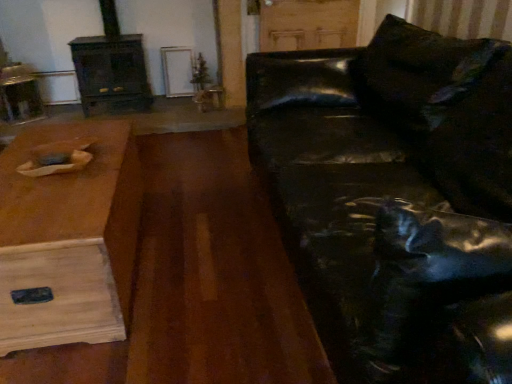
Question: Is dark wood fireplace at left touching shiny black leather couch at right?

Choices:
 (A) no
 (B) yes

Answer: (A)

Question: Is dark wood fireplace at left behind shiny black leather couch at right?

Choices:
 (A) yes
 (B) no

Answer: (A)

Question: Is dark wood fireplace at left far from shiny black leather couch at right?

Choices:
 (A) yes
 (B) no

Answer: (A)

Question: Does dark wood fireplace at left have a lesser width compared to shiny black leather couch at right?

Choices:
 (A) no
 (B) yes

Answer: (B)

Question: From the image's perspective, is dark wood fireplace at left beneath shiny black leather couch at right?

Choices:
 (A) no
 (B) yes

Answer: (A)

Question: Is point pyautogui.click(x=410, y=44) closer or farther from the camera than point pyautogui.click(x=110, y=69)?

Choices:
 (A) closer
 (B) farther

Answer: (A)

Question: Relative to dark wood fireplace at left, is shiny black leather couch at right in front or behind?

Choices:
 (A) front
 (B) behind

Answer: (A)

Question: Considering the positions of shiny black leather couch at right and dark wood fireplace at left in the image, is shiny black leather couch at right bigger or smaller than dark wood fireplace at left?

Choices:
 (A) small
 (B) big

Answer: (B)

Question: From a real-world perspective, is shiny black leather couch at right above or below dark wood fireplace at left?

Choices:
 (A) above
 (B) below

Answer: (B)

Question: Is wooden table at left in front of or behind shiny black leather couch at right in the image?

Choices:
 (A) front
 (B) behind

Answer: (B)

Question: Would you say wooden table at left is inside or outside shiny black leather couch at right?

Choices:
 (A) inside
 (B) outside

Answer: (B)

Question: In terms of height, does wooden table at left look taller or shorter compared to shiny black leather couch at right?

Choices:
 (A) tall
 (B) short

Answer: (B)

Question: In terms of size, does wooden table at left appear bigger or smaller than shiny black leather couch at right?

Choices:
 (A) small
 (B) big

Answer: (A)

Question: From a real-world perspective, is shiny black leather couch at right positioned above or below wooden table at left?

Choices:
 (A) above
 (B) below

Answer: (A)

Question: Looking at their shapes, would you say shiny black leather couch at right is wider or thinner than wooden table at left?

Choices:
 (A) thin
 (B) wide

Answer: (B)